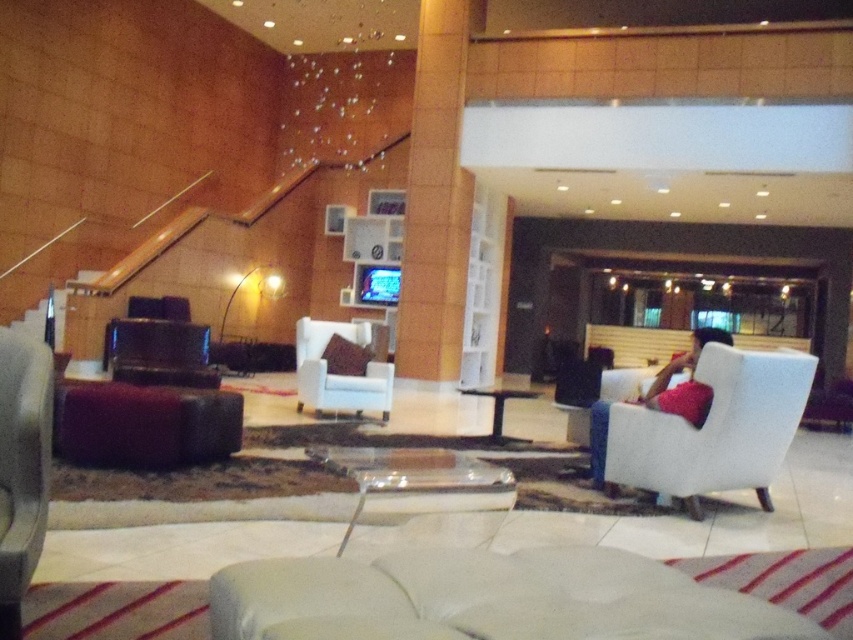
Does matte black armchair at left have a lesser height compared to matte black chair at left?

In fact, matte black armchair at left may be taller than matte black chair at left.

Is point (20, 467) positioned before point (125, 374)?

Yes, point (20, 467) is in front of point (125, 374).

You are a GUI agent. You are given a task and a screenshot of the screen. Output one action in this format:
    pyautogui.click(x=<x>, y=<y>)
    Task: Click on the matte black armchair at left
    The image size is (853, 640).
    Given the screenshot: What is the action you would take?
    pyautogui.click(x=22, y=467)

In the scene shown: Who is positioned more to the left, velvet dark brown ottoman at center or white fabric armchair at center?

velvet dark brown ottoman at center

Does point (158, 420) come in front of point (339, 388)?

Yes, it is in front of point (339, 388).

The image size is (853, 640). I want to click on velvet dark brown ottoman at center, so click(x=144, y=424).

Image resolution: width=853 pixels, height=640 pixels. What do you see at coordinates (144, 424) in the screenshot?
I see `velvet dark brown ottoman at center` at bounding box center [144, 424].

Does velvet dark brown ottoman at center have a lesser height compared to matte black armchair at left?

Indeed, velvet dark brown ottoman at center has a lesser height compared to matte black armchair at left.

The image size is (853, 640). I want to click on velvet dark brown ottoman at center, so click(144, 424).